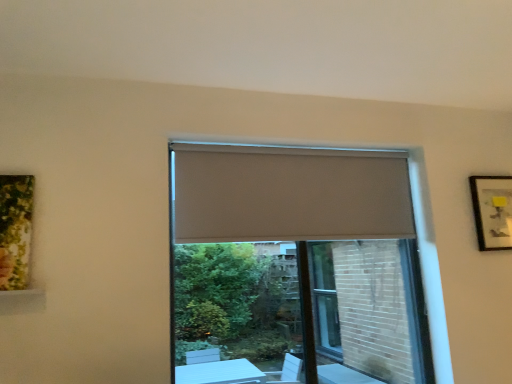
Question: Should I look upward or downward to see beige fabric window at center?

Choices:
 (A) up
 (B) down

Answer: (B)

Question: Is the position of matte gray screen door at center more distant than that of beige fabric window at center?

Choices:
 (A) yes
 (B) no

Answer: (A)

Question: Is matte gray screen door at center to the right of beige fabric window at center from the viewer's perspective?

Choices:
 (A) yes
 (B) no

Answer: (A)

Question: Considering the relative sizes of matte gray screen door at center and beige fabric window at center in the image provided, is matte gray screen door at center taller than beige fabric window at center?

Choices:
 (A) no
 (B) yes

Answer: (A)

Question: Could you tell me if matte gray screen door at center is turned towards beige fabric window at center?

Choices:
 (A) no
 (B) yes

Answer: (B)

Question: Can beige fabric window at center be found inside matte gray screen door at center?

Choices:
 (A) no
 (B) yes

Answer: (B)

Question: Is matte gray screen door at center smaller than beige fabric window at center?

Choices:
 (A) yes
 (B) no

Answer: (A)

Question: Does matte black picture frame at upper right have a smaller size compared to matte gray screen door at center?

Choices:
 (A) no
 (B) yes

Answer: (B)

Question: Is matte black picture frame at upper right bigger than matte gray screen door at center?

Choices:
 (A) no
 (B) yes

Answer: (A)

Question: Is matte black picture frame at upper right aimed at matte gray screen door at center?

Choices:
 (A) yes
 (B) no

Answer: (B)

Question: From a real-world perspective, is matte black picture frame at upper right beneath matte gray screen door at center?

Choices:
 (A) no
 (B) yes

Answer: (A)

Question: Considering the relative positions of matte black picture frame at upper right and matte gray screen door at center in the image provided, is matte black picture frame at upper right to the right of matte gray screen door at center from the viewer's perspective?

Choices:
 (A) no
 (B) yes

Answer: (B)

Question: Would you say matte gray screen door at center is part of matte black picture frame at upper right's contents?

Choices:
 (A) yes
 (B) no

Answer: (B)

Question: Is matte gray screen door at center shorter than beige fabric curtain at center?

Choices:
 (A) no
 (B) yes

Answer: (A)